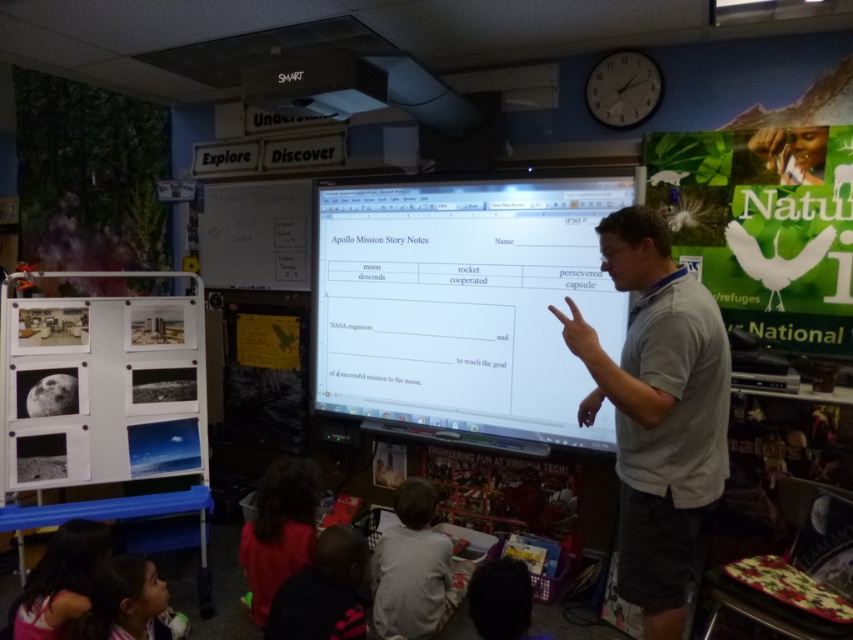
Who is more forward, (612, 196) or (344, 593)?

Point (344, 593) is more forward.

Is white glossy computer screen at center taller than dark blue sweater at lower left?

Yes, white glossy computer screen at center is taller than dark blue sweater at lower left.

At what (x,y) coordinates should I click in order to perform the action: click on white glossy computer screen at center. Please return your answer as a coordinate pair (x, y). This screenshot has height=640, width=853. Looking at the image, I should click on (463, 304).

The image size is (853, 640). What are the coordinates of `white glossy computer screen at center` in the screenshot? It's located at pyautogui.click(x=463, y=304).

Who is positioned more to the right, gray cotton shirt at upper right or white matte dry erase board at upper left?

gray cotton shirt at upper right

Between point (636, 262) and point (299, 253), which one is positioned behind?

Point (299, 253)

Between point (680, 461) and point (280, 204), which one is positioned in front?

Positioned in front is point (680, 461).

I want to click on gray cotton shirt at upper right, so click(657, 412).

Who is more distant from viewer, (549, 252) or (408, 604)?

The point (549, 252) is behind.

In the scene shown: Is white glossy computer screen at center behind gray fabric shirt at lower center?

That is True.

Is point (514, 376) positioned after point (404, 541)?

Yes, it is behind point (404, 541).

Find the location of `white glossy computer screen at center`. white glossy computer screen at center is located at coordinates (463, 304).